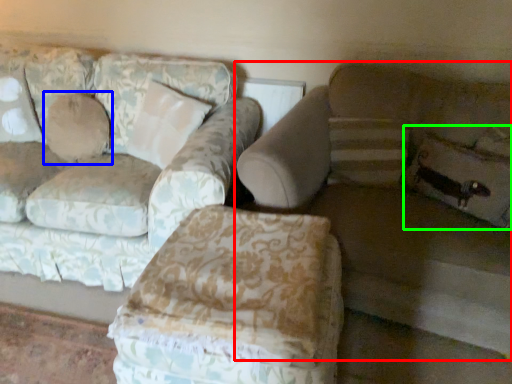
Question: Based on their relative distances, which object is nearer to studio couch (highlighted by a red box)? Choose from pillow (highlighted by a blue box) and pillow (highlighted by a green box).

Choices:
 (A) pillow
 (B) pillow

Answer: (B)